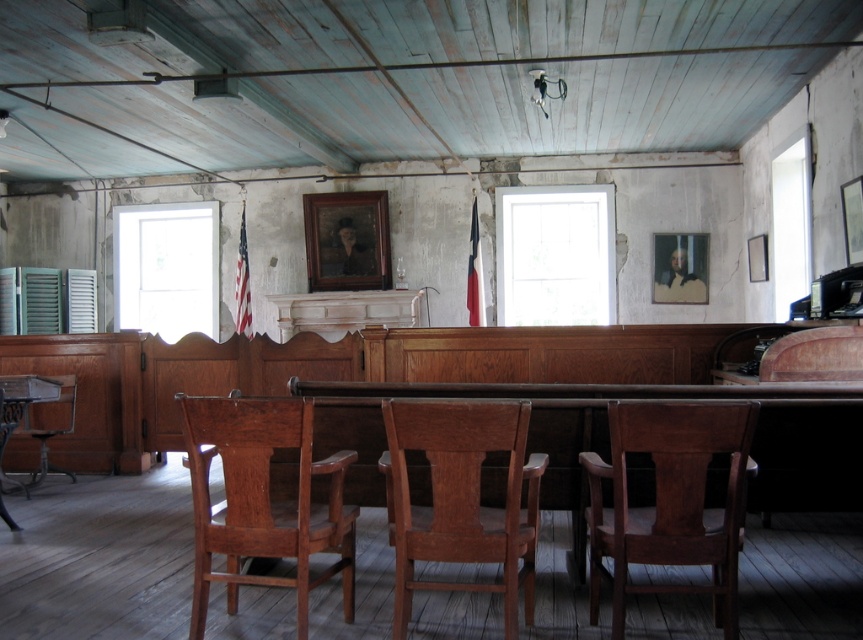
From the picture: You are standing in the courtroom and want to move from the entrance to the wooden chair at left. There is a white painted wood shutter at left in your path. Can you walk directly to the chair without going around the shutter?

The white painted wood shutter at left is further to the viewer than wooden chair at left, so the shutter is closer to you. Therefore, you would need to go around the shutter to reach the wooden chair at left.

In the scene shown: You are standing in the courtroom and need to locate the white painted wood shutter at left. According to the coordinates provided, where exactly would you find it?

The white painted wood shutter at left is located at coordinates point (48, 300).